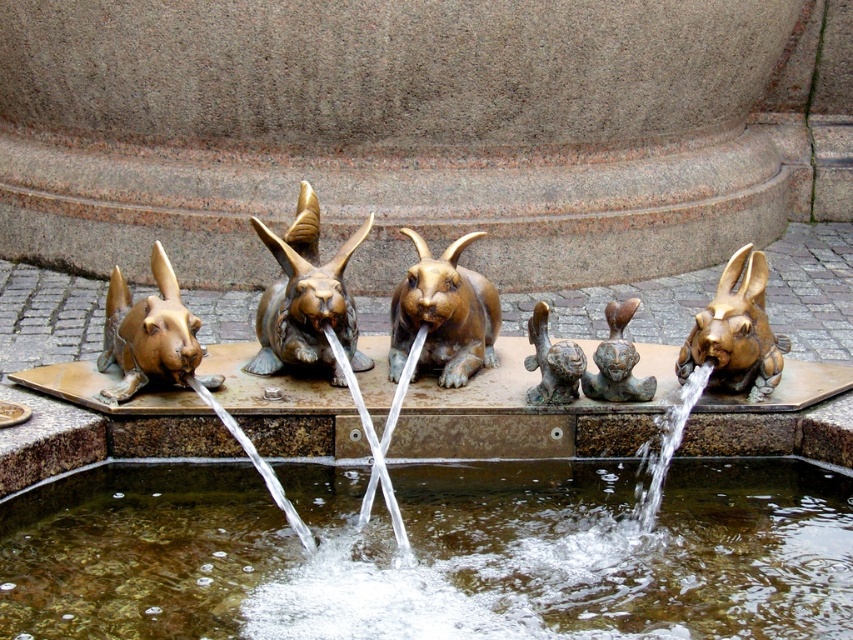
Between clear water at fountain center and bronze rabbit at center, which one appears on the left side from the viewer's perspective?

bronze rabbit at center

Does clear water at fountain center have a lesser height compared to bronze rabbit at center?

Yes.

Is point (35, 570) farther from camera compared to point (268, 294)?

No, it is in front of (268, 294).

I want to click on clear water at fountain center, so click(431, 552).

Does point (724, 264) lie behind point (538, 300)?

Yes, point (724, 264) is behind point (538, 300).

Is gold-bronze rabbit at right to the left of brass rabbit at center from the viewer's perspective?

Incorrect, gold-bronze rabbit at right is not on the left side of brass rabbit at center.

Who is more forward, (752, 330) or (549, 401)?

Point (549, 401) is more forward.

Find the location of a particular element. gold-bronze rabbit at right is located at coordinates (735, 332).

Can you confirm if gold metallic rabbit at left is positioned above bronze/brass figure at center?

Correct, gold metallic rabbit at left is located above bronze/brass figure at center.

Who is more forward, (x=163, y=324) or (x=602, y=388)?

Positioned in front is point (x=163, y=324).

I want to click on gold metallic rabbit at left, so click(x=148, y=332).